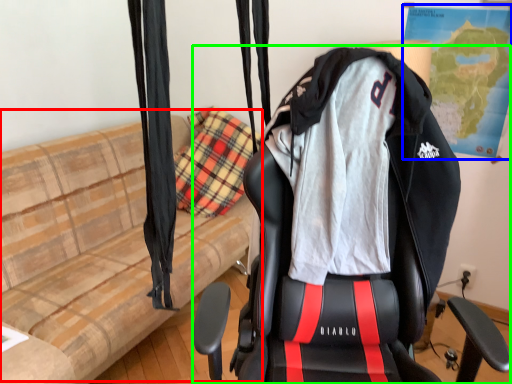
Question: Which object is positioned closest to couch (highlighted by a red box)? Select from map (highlighted by a blue box) and chair (highlighted by a green box).

Choices:
 (A) map
 (B) chair

Answer: (B)